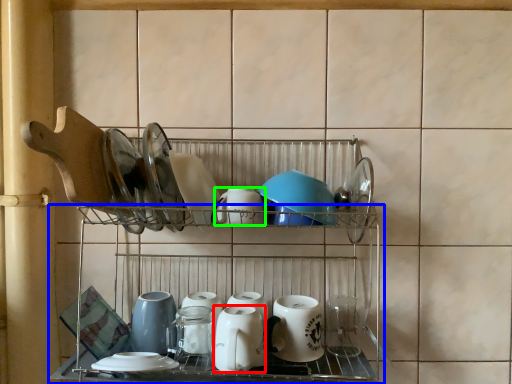
Question: Which object is the closest to the tableware (highlighted by a red box)? Choose among these: shelf (highlighted by a blue box) or tableware (highlighted by a green box).

Choices:
 (A) shelf
 (B) tableware

Answer: (A)